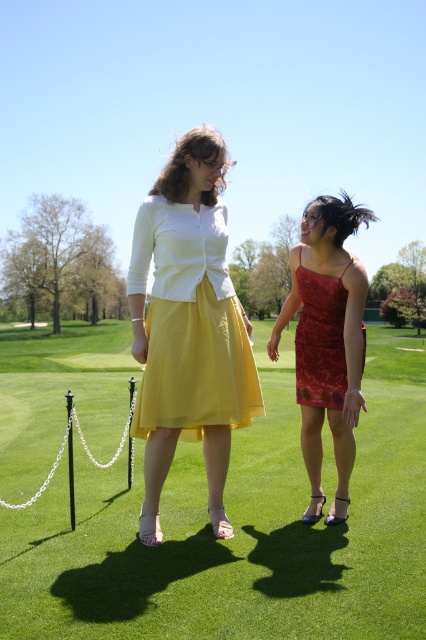
Question: Among these objects, which one is farthest from the camera?

Choices:
 (A) green grass at center
 (B) matte red dress at center
 (C) yellow chiffon skirt at center
 (D) shiny red dress at center

Answer: (B)

Question: Is green grass at center bigger than shiny red dress at center?

Choices:
 (A) no
 (B) yes

Answer: (B)

Question: Which object appears farthest from the camera in this image?

Choices:
 (A) shiny red dress at center
 (B) yellow chiffon skirt at center
 (C) green grass at center

Answer: (B)

Question: Is green grass at center bigger than yellow chiffon skirt at center?

Choices:
 (A) yes
 (B) no

Answer: (A)

Question: Is green grass at center wider than shiny red dress at center?

Choices:
 (A) yes
 (B) no

Answer: (A)

Question: Which point is closer to the camera?

Choices:
 (A) yellow chiffon skirt at center
 (B) matte red dress at center
 (C) green grass at center
 (D) shiny red dress at center

Answer: (C)